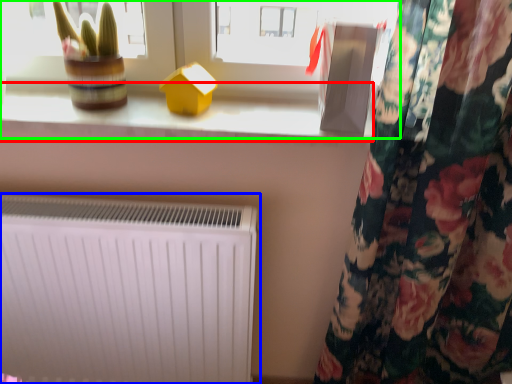
Question: Which object is positioned closest to window sill (highlighted by a red box)? Select from radiator (highlighted by a blue box) and window (highlighted by a green box).

Choices:
 (A) radiator
 (B) window

Answer: (B)